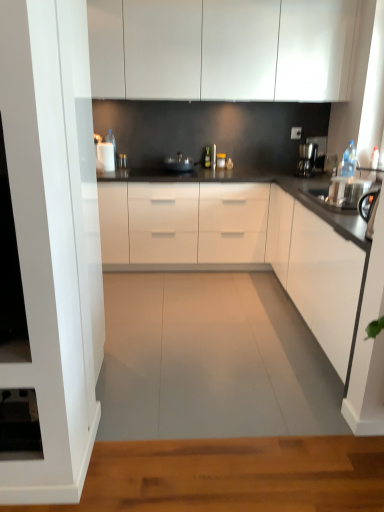
Question: From the image's perspective, is white glossy countertop at center, the first countertop in the back-to-front sequence, located above or below black glossy countertop at center, positioned as the second countertop in back-to-front order?

Choices:
 (A) above
 (B) below

Answer: (A)

Question: In the image, is white glossy countertop at center, which is the second countertop in front-to-back order, positioned in front of or behind black glossy countertop at center, positioned as the second countertop in back-to-front order?

Choices:
 (A) behind
 (B) front

Answer: (A)

Question: Which object is positioned farthest from the black glossy countertop at center, positioned as the second countertop in back-to-front order?

Choices:
 (A) metallic silver pan at center
 (B) white glossy cabinet at right, which ranks as the second cabinetry in top-to-bottom order
 (C) white glossy countertop at center, the first countertop in the back-to-front sequence
 (D) sleek black coffee machine at right
 (E) white glossy cabinets at upper center, the first cabinetry in the top-to-bottom sequence

Answer: (D)

Question: Which object is the farthest from the sleek black coffee machine at right?

Choices:
 (A) white glossy countertop at center, which is the second countertop in front-to-back order
 (B) metallic silver pan at center
 (C) white glossy cabinets at upper center, the first cabinetry in the top-to-bottom sequence
 (D) white glossy cabinet at right, which ranks as the second cabinetry in top-to-bottom order
 (E) black glossy countertop at center, the 1th countertop in the front-to-back sequence

Answer: (D)